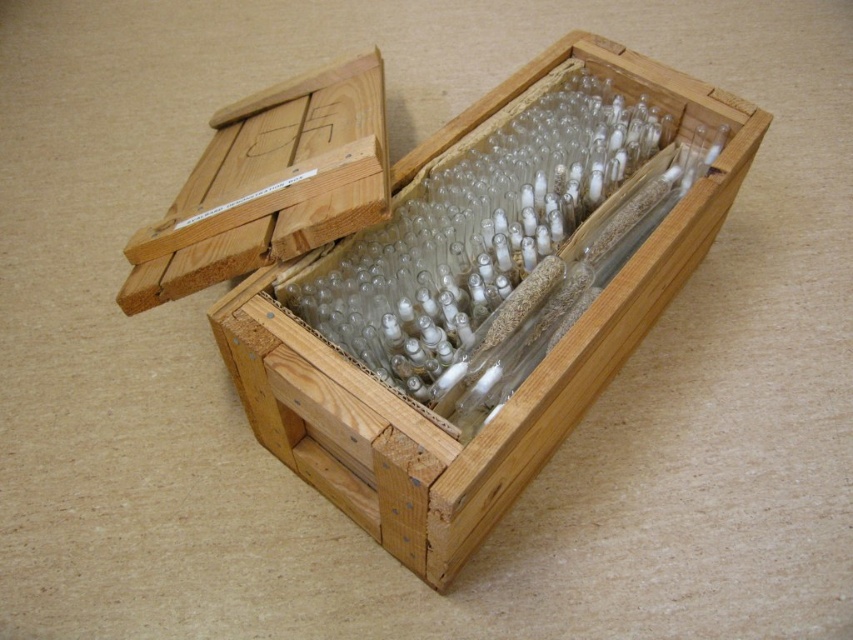
Between natural wood box at center and natural wood box at upper left, which one has more height?

natural wood box at center

Does point (339, 396) come behind point (224, 266)?

No, (339, 396) is closer to viewer.

Locate an element on the screen. This screenshot has height=640, width=853. natural wood box at center is located at coordinates (521, 384).